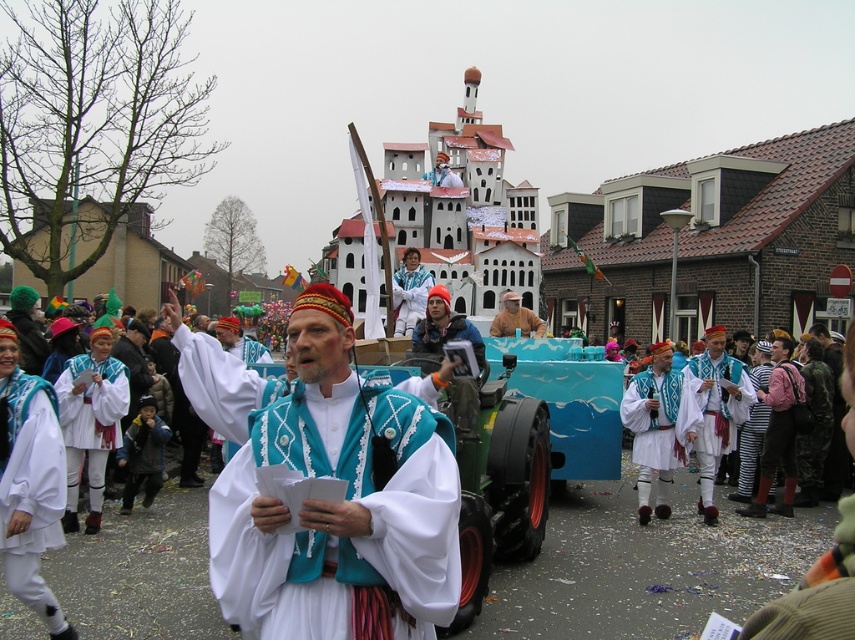
Is point (706, 460) positioned behind point (746, 474)?

No, (706, 460) is in front of (746, 474).

Locate an element on the screen. The image size is (855, 640). white cotton outfit at center is located at coordinates (716, 410).

How much distance is there between white satin robe at center and white fabric costume at center?

white satin robe at center is 19.10 meters from white fabric costume at center.

Does point (361, 563) come closer to viewer compared to point (401, 324)?

Yes, point (361, 563) is in front of point (401, 324).

This screenshot has width=855, height=640. What do you see at coordinates (319, 500) in the screenshot? I see `white satin robe at center` at bounding box center [319, 500].

The height and width of the screenshot is (640, 855). I want to click on white satin robe at center, so click(x=319, y=500).

Can you confirm if white cotton pants at lower left is thinner than brown fabric hat at center?

Indeed, white cotton pants at lower left has a lesser width compared to brown fabric hat at center.

Who is taller, white cotton pants at lower left or brown fabric hat at center?

With more height is brown fabric hat at center.

Does point (0, 520) come behind point (529, 330)?

No.

This screenshot has height=640, width=855. I want to click on white cotton pants at lower left, so pyautogui.click(x=30, y=488).